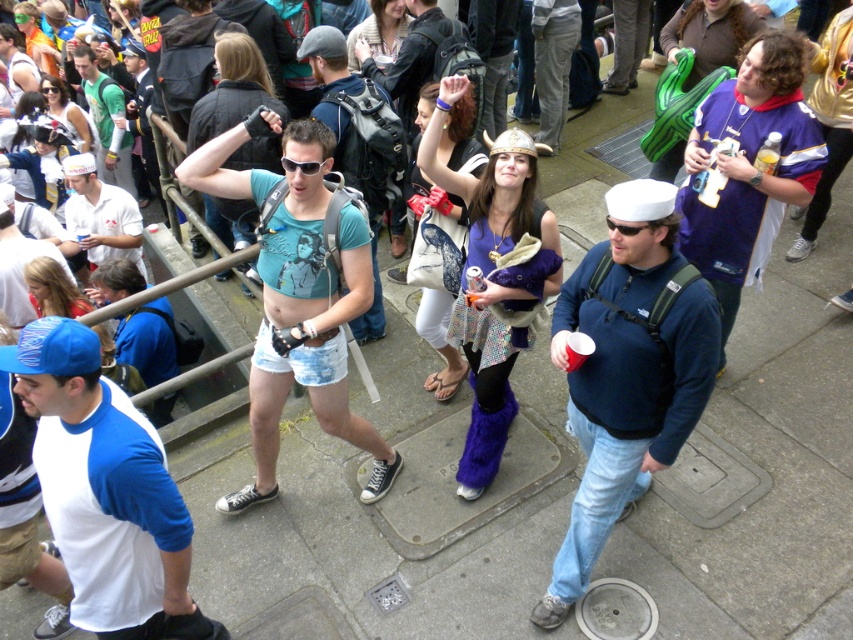
Based on the photo, you are organizing a group photo and need to arrange the purple jersey at right and the matte teal tank top at center so that both fit within a 2m wide frame. Given their widths, which one should be placed closer to the edge to ensure they both fit?

The purple jersey at right is narrower than the matte teal tank top at center, so placing the purple jersey at right closer to the edge would allow both to fit within the 2m wide frame.

You are a photographer standing near the camera in the scene. You want to pick up the white matte cap at left to adjust its position for a better shot. Can you reach it without moving from your current position? The camera has a 1.5 meter reach extension.

The white matte cap at left is 5.91 meters away from the camera. Since the camera only has a 1.5 meter reach extension, you cannot reach the white matte cap at left without moving closer.